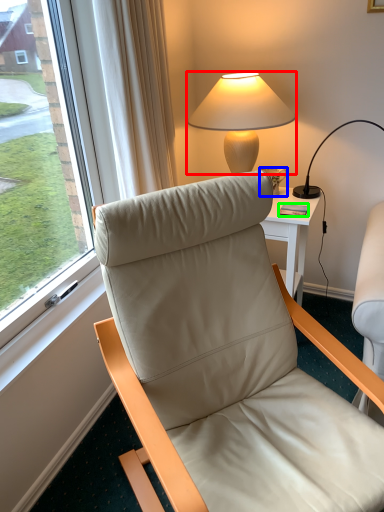
Question: Considering the real-world distances, which object is farthest from lamp (highlighted by a red box)? coffee cup (highlighted by a blue box) or mobile phone (highlighted by a green box)?

Choices:
 (A) coffee cup
 (B) mobile phone

Answer: (B)